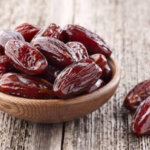
Locate an element on the screen. The image size is (150, 150). darker wood table is located at coordinates (32, 139).